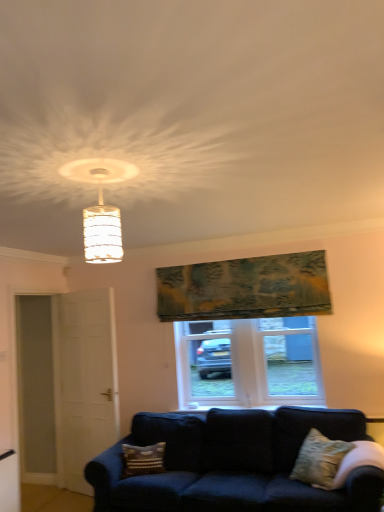
Question: Is patterned fabric pillow at lower center, positioned as the second pillow in front-to-back order, not inside textured green tapestry at upper center?

Choices:
 (A) no
 (B) yes

Answer: (B)

Question: Can you confirm if patterned fabric pillow at lower center, which is the first pillow in left-to-right order, is thinner than textured green tapestry at upper center?

Choices:
 (A) no
 (B) yes

Answer: (B)

Question: From the image's perspective, would you say patterned fabric pillow at lower center, positioned as the second pillow in front-to-back order, is shown under textured green tapestry at upper center?

Choices:
 (A) yes
 (B) no

Answer: (A)

Question: From the image's perspective, is patterned fabric pillow at lower center, acting as the 2th pillow starting from the right, on top of textured green tapestry at upper center?

Choices:
 (A) no
 (B) yes

Answer: (A)

Question: Is patterned fabric pillow at lower center, which is the first pillow in left-to-right order, to the left of textured green tapestry at upper center from the viewer's perspective?

Choices:
 (A) no
 (B) yes

Answer: (B)

Question: Visually, is patterned fabric pillow at lower center, acting as the 2th pillow starting from the right, positioned to the left or to the right of white plastic window at center?

Choices:
 (A) left
 (B) right

Answer: (A)

Question: From the image's perspective, is patterned fabric pillow at lower center, which is the first pillow in left-to-right order, positioned above or below white plastic window at center?

Choices:
 (A) above
 (B) below

Answer: (B)

Question: Considering the positions of patterned fabric pillow at lower center, which is the first pillow in left-to-right order, and white plastic window at center in the image, is patterned fabric pillow at lower center, which is the first pillow in left-to-right order, wider or thinner than white plastic window at center?

Choices:
 (A) thin
 (B) wide

Answer: (B)

Question: Does point (157, 468) appear closer or farther from the camera than point (269, 395)?

Choices:
 (A) farther
 (B) closer

Answer: (B)

Question: Is textured green tapestry at upper center taller or shorter than white matte door at left?

Choices:
 (A) short
 (B) tall

Answer: (A)

Question: Considering the positions of point (162, 307) and point (84, 450), is point (162, 307) closer or farther from the camera than point (84, 450)?

Choices:
 (A) farther
 (B) closer

Answer: (A)

Question: In the image, is textured green tapestry at upper center on the left side or the right side of white matte door at left?

Choices:
 (A) left
 (B) right

Answer: (B)

Question: Considering their positions, is textured green tapestry at upper center located in front of or behind white matte door at left?

Choices:
 (A) front
 (B) behind

Answer: (A)

Question: Is white plastic window at center wider or thinner than white matte door at left?

Choices:
 (A) wide
 (B) thin

Answer: (A)

Question: Considering the positions of white plastic window at center and white matte door at left in the image, is white plastic window at center taller or shorter than white matte door at left?

Choices:
 (A) tall
 (B) short

Answer: (B)